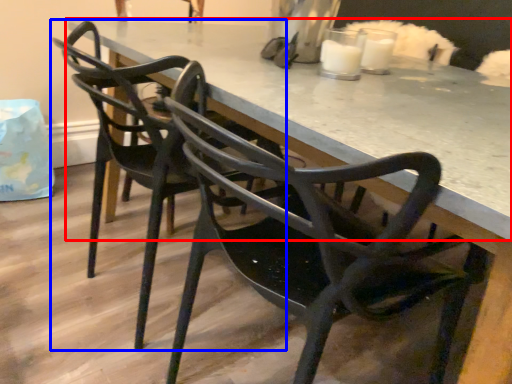
Question: Which point is closer to the camera, table (highlighted by a red box) or chair (highlighted by a blue box)?

Choices:
 (A) table
 (B) chair

Answer: (A)